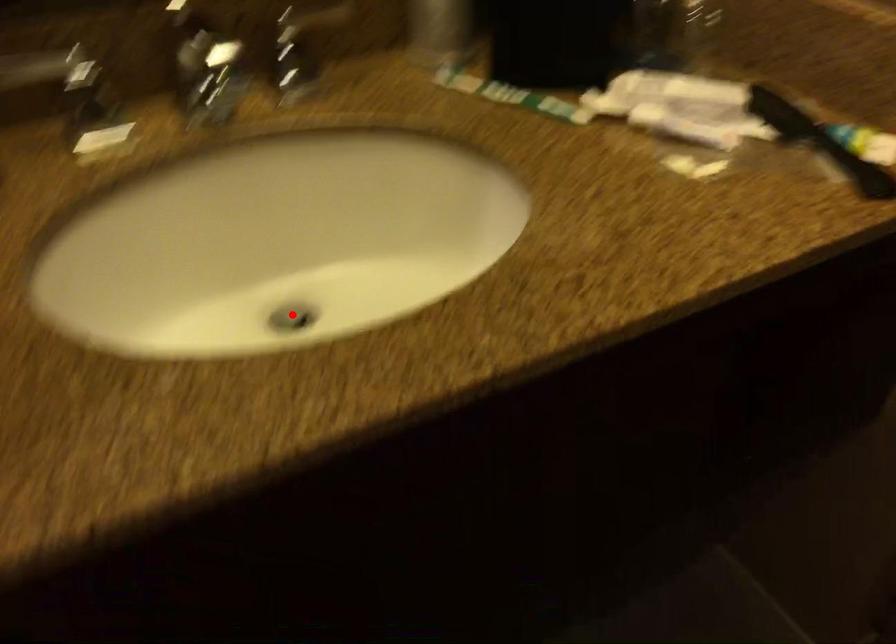
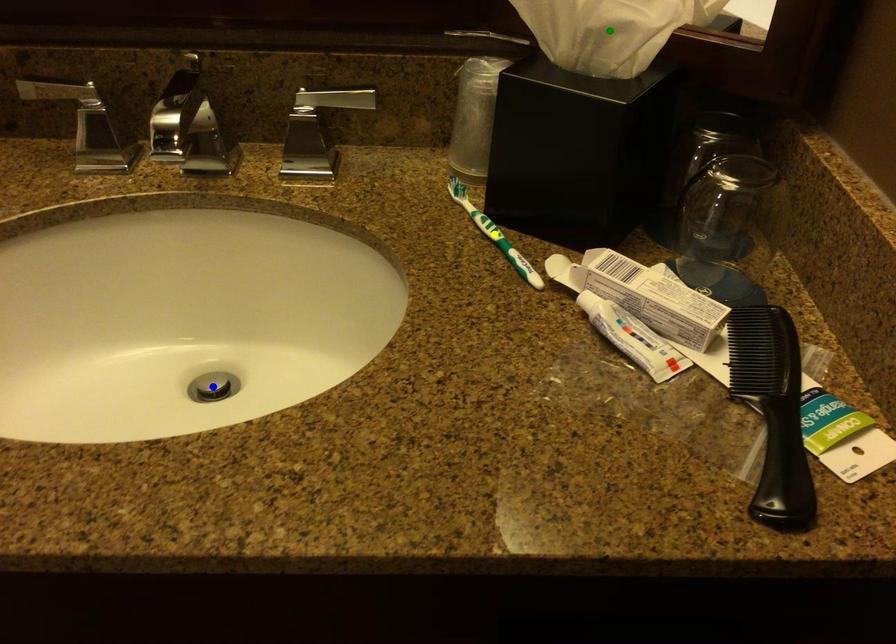
Question: I am providing you with two images of the same scene from different viewpoints. A red point is marked on the first image. You are given multiple points on the second image. Which point in image 2 represents the same 3d spot as the red point in image 1?

Choices:
 (A) yellow point
 (B) green point
 (C) blue point

Answer: (C)